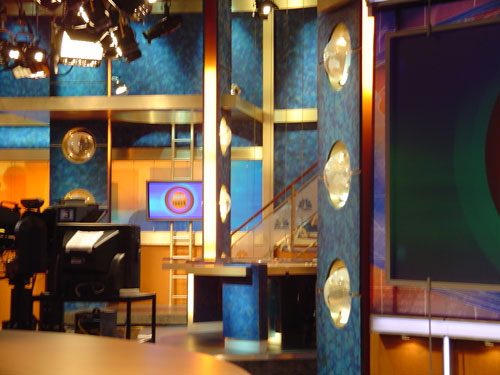
This screenshot has height=375, width=500. I want to click on glass, so click(277, 220).